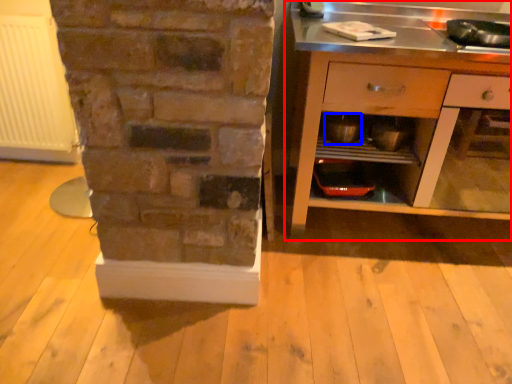
Question: Which object appears closest to the camera in this image, cabinetry (highlighted by a red box) or appliance (highlighted by a blue box)?

Choices:
 (A) cabinetry
 (B) appliance

Answer: (A)